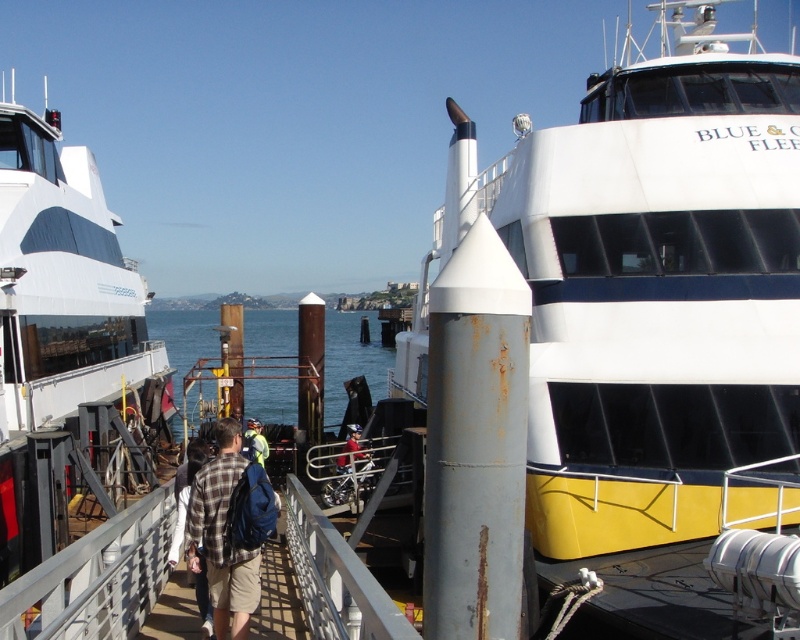
You are a photographer at the ferry terminal trying to capture both the white matte boat at left and the plaid fabric shirt at center in a single frame. Given their sizes, which object should you position closer to the camera to ensure both are clearly visible?

The white matte boat at left is larger in size than the plaid fabric shirt at center. To ensure both are clearly visible in the frame, position the plaid fabric shirt at center closer to the camera and the white matte boat at left farther away.

You are a photographer standing at the ferry terminal and want to capture both the white matte boat at center and the plaid fabric shirt at center in a single wide shot. Given that your camera can only focus on objects within a 10 meter width, will both subjects fit within the frame?

The white matte boat at center is wider than the plaid fabric shirt at center. Since the camera can focus on objects within a 10 meter width, and the boat is the wider object, it depends on the actual width of the boat. However, the description only states the boat is larger in width than the shirt, but does not provide exact measurements. Without specific dimensions, it is impossible to determine if both will fit within the 10 meter frame.